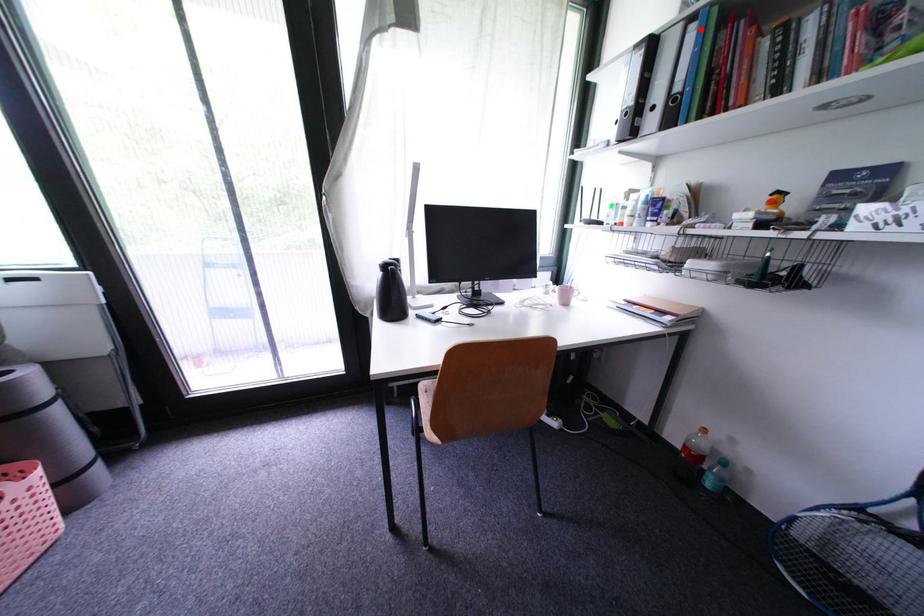
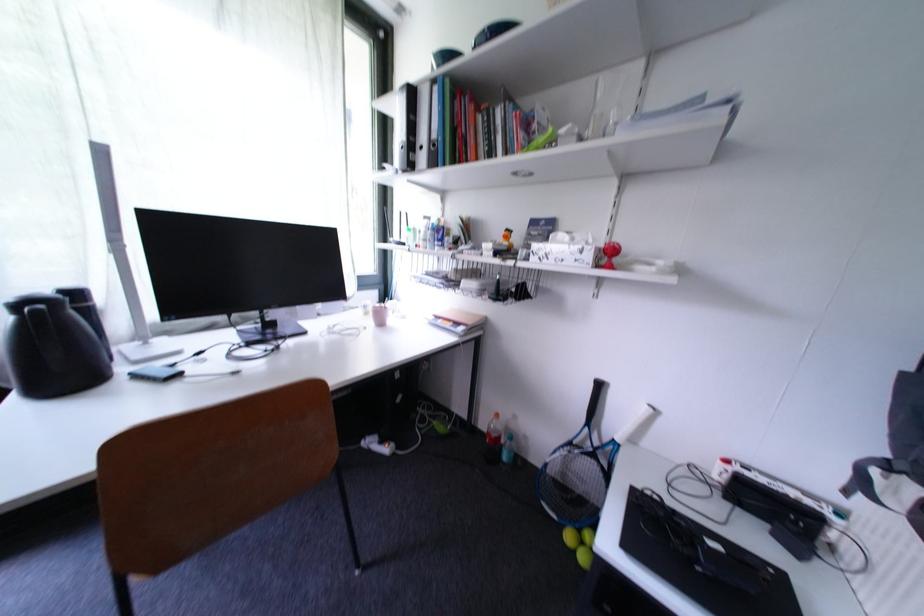
Question: I am providing you with two images of the same scene from different viewpoints. A red point is shown in image1. For the corresponding object point in image2, is it positioned nearer or farther from the camera?

Choices:
 (A) Nearer
 (B) Farther

Answer: (A)